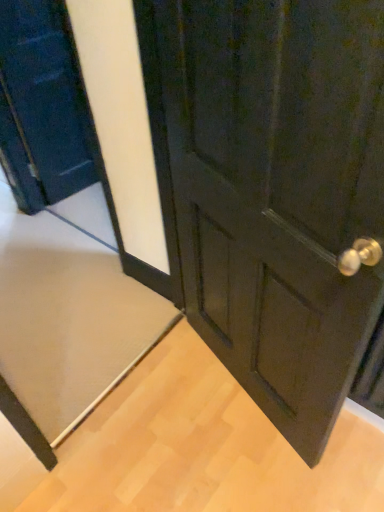
Question: From the image's perspective, is matte black door at center, positioned as the 1th door in right-to-left order, located beneath matte black door at left, placed as the first door when sorted from left to right?

Choices:
 (A) yes
 (B) no

Answer: (A)

Question: Is matte black door at center, the 2th door viewed from the left, oriented towards matte black door at left, placed as the first door when sorted from left to right?

Choices:
 (A) no
 (B) yes

Answer: (A)

Question: Is matte black door at center, the 2th door viewed from the left, completely or partially outside of matte black door at left, which appears as the 2th door when viewed from the right?

Choices:
 (A) yes
 (B) no

Answer: (A)

Question: Is matte black door at center, positioned as the 1th door in right-to-left order, to the right of matte black door at left, which appears as the 2th door when viewed from the right, from the viewer's perspective?

Choices:
 (A) no
 (B) yes

Answer: (B)

Question: Does matte black door at center, positioned as the 1th door in right-to-left order, come in front of matte black door at left, placed as the first door when sorted from left to right?

Choices:
 (A) yes
 (B) no

Answer: (A)

Question: From the image's perspective, relative to matte black door at center, the 2th door viewed from the left, is matte black door at left, which appears as the 2th door when viewed from the right, above or below?

Choices:
 (A) below
 (B) above

Answer: (B)

Question: Is matte black door at left, placed as the first door when sorted from left to right, wider or thinner than matte black door at center, positioned as the 1th door in right-to-left order?

Choices:
 (A) wide
 (B) thin

Answer: (B)

Question: Would you say matte black door at left, which appears as the 2th door when viewed from the right, is to the left or to the right of matte black door at center, positioned as the 1th door in right-to-left order, in the picture?

Choices:
 (A) left
 (B) right

Answer: (A)

Question: In the image, is matte black door at left, placed as the first door when sorted from left to right, positioned in front of or behind matte black door at center, positioned as the 1th door in right-to-left order?

Choices:
 (A) behind
 (B) front

Answer: (A)

Question: Would you say matte black door at center, the 2th door viewed from the left, is to the left or to the right of beige carpet at lower left in the picture?

Choices:
 (A) left
 (B) right

Answer: (B)

Question: From the image's perspective, is matte black door at center, the 2th door viewed from the left, above or below beige carpet at lower left?

Choices:
 (A) below
 (B) above

Answer: (B)

Question: Does point click(258, 169) appear closer or farther from the camera than point click(39, 402)?

Choices:
 (A) farther
 (B) closer

Answer: (B)

Question: Is matte black door at center, positioned as the 1th door in right-to-left order, spatially inside beige carpet at lower left, or outside of it?

Choices:
 (A) inside
 (B) outside

Answer: (B)

Question: From a real-world perspective, is matte black door at center, positioned as the 1th door in right-to-left order, physically located above or below matte black door at left, placed as the first door when sorted from left to right?

Choices:
 (A) below
 (B) above

Answer: (B)

Question: From the image's perspective, is matte black door at center, the 2th door viewed from the left, located above or below matte black door at left, placed as the first door when sorted from left to right?

Choices:
 (A) below
 (B) above

Answer: (A)